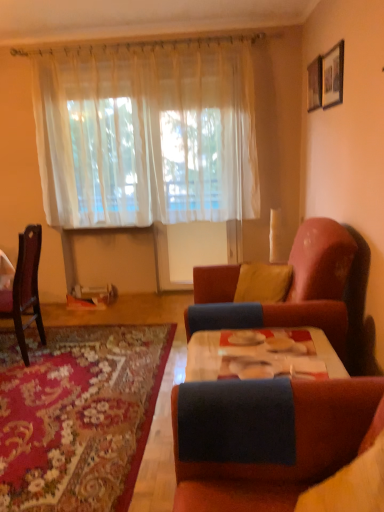
The width and height of the screenshot is (384, 512). Identify the location of translucent fabric curtain at center. (201, 140).

What do you see at coordinates (25, 288) in the screenshot?
I see `dark wood chair at left` at bounding box center [25, 288].

What do you see at coordinates (315, 84) in the screenshot? The height and width of the screenshot is (512, 384). I see `wooden picture frame at upper right, placed as the 1th picture frame when sorted from back to front` at bounding box center [315, 84].

This screenshot has height=512, width=384. Describe the element at coordinates (146, 134) in the screenshot. I see `sheer white curtain at upper center` at that location.

The height and width of the screenshot is (512, 384). What do you see at coordinates (333, 76) in the screenshot?
I see `wooden picture frame at upper right, acting as the 2th picture frame starting from the back` at bounding box center [333, 76].

I want to click on wooden picture frame at upper right, arranged as the first picture frame when viewed from the front, so click(333, 76).

Find the location of a particular element. This screenshot has width=384, height=512. carpeted rug at lower left is located at coordinates (78, 415).

Locate an element on the screen. This screenshot has width=384, height=512. yellow fabric pillow at center is located at coordinates (263, 282).

Is wooden picture frame at upper right, arranged as the first picture frame when viewed from the front, in contact with carpeted rug at lower left?

No, wooden picture frame at upper right, arranged as the first picture frame when viewed from the front, is not beside carpeted rug at lower left.

Locate an element on the screen. Image resolution: width=384 pixels, height=512 pixels. mat lying on the left of wooden picture frame at upper right, arranged as the first picture frame when viewed from the front is located at coordinates (78, 415).

From a real-world perspective, which is physically below, wooden picture frame at upper right, acting as the 2th picture frame starting from the back, or carpeted rug at lower left?

carpeted rug at lower left is physically lower.

Based on the photo, which is more distant, (332, 86) or (142, 337)?

Positioned behind is point (142, 337).

Is carpeted rug at lower left looking in the opposite direction of yellow fabric pillow at center?

No, yellow fabric pillow at center is not at the back of carpeted rug at lower left.

Are carpeted rug at lower left and yellow fabric pillow at center making contact?

There is a gap between carpeted rug at lower left and yellow fabric pillow at center.

From a real-world perspective, is carpeted rug at lower left under yellow fabric pillow at center?

Correct, in the physical world, carpeted rug at lower left is lower than yellow fabric pillow at center.

Is carpeted rug at lower left spatially inside yellow fabric pillow at center, or outside of it?

carpeted rug at lower left is not inside yellow fabric pillow at center, it's outside.

The height and width of the screenshot is (512, 384). I want to click on mat lying below the yellow fabric pillow at center (from the image's perspective), so click(x=78, y=415).

Based on the photo, considering their positions, is yellow fabric pillow at center located in front of or behind carpeted rug at lower left?

yellow fabric pillow at center is positioned farther from the viewer than carpeted rug at lower left.

Based on their positions, is yellow fabric pillow at center located to the left or right of carpeted rug at lower left?

Based on their positions, yellow fabric pillow at center is located to the right of carpeted rug at lower left.

From the image's perspective, which is above, dark wood chair at left or wooden picture frame at upper right, which appears as the second picture frame when viewed from the front?

wooden picture frame at upper right, which appears as the second picture frame when viewed from the front, is shown above in the image.

Which is behind, dark wood chair at left or wooden picture frame at upper right, which appears as the second picture frame when viewed from the front?

Positioned behind is wooden picture frame at upper right, which appears as the second picture frame when viewed from the front.

Is dark wood chair at left aimed at wooden picture frame at upper right, which appears as the second picture frame when viewed from the front?

No, dark wood chair at left is not oriented towards wooden picture frame at upper right, which appears as the second picture frame when viewed from the front.

Which is correct: carpeted rug at lower left is inside velvet pink couch at right, or outside of it?

carpeted rug at lower left is outside velvet pink couch at right.

How many degrees apart are the facing directions of carpeted rug at lower left and velvet pink couch at right?

The angle between the facing direction of carpeted rug at lower left and the facing direction of velvet pink couch at right is 88.8 degrees.

Is carpeted rug at lower left wider or thinner than velvet pink couch at right?

In the image, carpeted rug at lower left appears to be wider than velvet pink couch at right.

Is carpeted rug at lower left at the right side of velvet pink couch at right?

Incorrect, carpeted rug at lower left is not on the right side of velvet pink couch at right.

Consider the image. Is sheer white curtain at upper center behind wooden picture frame at upper right, acting as the 2th picture frame starting from the back?

Yes, sheer white curtain at upper center is behind wooden picture frame at upper right, acting as the 2th picture frame starting from the back.

Image resolution: width=384 pixels, height=512 pixels. I want to click on curtain that is below the wooden picture frame at upper right, acting as the 2th picture frame starting from the back (from the image's perspective), so click(146, 134).

Is sheer white curtain at upper center completely or partially outside of wooden picture frame at upper right, arranged as the first picture frame when viewed from the front?

Yes, sheer white curtain at upper center is outside of wooden picture frame at upper right, arranged as the first picture frame when viewed from the front.

Is sheer white curtain at upper center with wooden picture frame at upper right, arranged as the first picture frame when viewed from the front?

No, sheer white curtain at upper center is not in contact with wooden picture frame at upper right, arranged as the first picture frame when viewed from the front.

Could you tell me if translucent fabric curtain at center is turned towards velvet pink couch at right?

Yes.

Based on the photo, from a real-world perspective, is translucent fabric curtain at center physically located above or below velvet pink couch at right?

From a real-world perspective, translucent fabric curtain at center is physically above velvet pink couch at right.

Looking at this image, which of these two, translucent fabric curtain at center or velvet pink couch at right, stands taller?

translucent fabric curtain at center.

At what (x,y) coordinates should I click in order to perform the action: click on mat that appears below the wooden picture frame at upper right, acting as the 2th picture frame starting from the back (from the image's perspective). Please return your answer as a coordinate pair (x, y). Looking at the image, I should click on (78, 415).

Identify the location of pillow lying behind the carpeted rug at lower left. This screenshot has height=512, width=384. pos(263,282).

Consider the image. Based on their spatial positions, is sheer white curtain at upper center or yellow fabric pillow at center closer to wooden picture frame at upper right, arranged as the first picture frame when viewed from the front?

Based on the image, yellow fabric pillow at center appears to be nearer to wooden picture frame at upper right, arranged as the first picture frame when viewed from the front.

Based on the photo, estimate the real-world distances between objects in this image. Which object is further from carpeted rug at lower left, sheer white curtain at upper center or wooden picture frame at upper right, placed as the 1th picture frame when sorted from back to front?

wooden picture frame at upper right, placed as the 1th picture frame when sorted from back to front, is positioned further to the anchor carpeted rug at lower left.

Estimate the real-world distances between objects in this image. Which object is closer to dark wood chair at left, yellow fabric pillow at center or carpeted rug at lower left?

Among the two, carpeted rug at lower left is located nearer to dark wood chair at left.

Looking at the image, which one is located further to translucent fabric curtain at center, sheer white curtain at upper center or yellow fabric pillow at center?

Among the two, yellow fabric pillow at center is located further to translucent fabric curtain at center.

From the image, which object appears to be nearer to sheer white curtain at upper center, yellow fabric pillow at center or translucent fabric curtain at center?

translucent fabric curtain at center is closer to sheer white curtain at upper center.

Looking at the image, which one is located closer to yellow fabric pillow at center, sheer white curtain at upper center or dark wood chair at left?

sheer white curtain at upper center lies closer to yellow fabric pillow at center than the other object.

Based on their spatial positions, is wooden picture frame at upper right, acting as the 2th picture frame starting from the back, or translucent fabric curtain at center further from wooden picture frame at upper right, placed as the 1th picture frame when sorted from back to front?

translucent fabric curtain at center lies further to wooden picture frame at upper right, placed as the 1th picture frame when sorted from back to front, than the other object.

Looking at the image, which one is located further to wooden picture frame at upper right, placed as the 1th picture frame when sorted from back to front, yellow fabric pillow at center or carpeted rug at lower left?

The object further to wooden picture frame at upper right, placed as the 1th picture frame when sorted from back to front, is carpeted rug at lower left.

Locate an element on the screen. This screenshot has width=384, height=512. curtain between wooden picture frame at upper right, acting as the 2th picture frame starting from the back, and velvet pink couch at right, in the vertical direction is located at coordinates 146,134.

In order to click on studio couch between wooden picture frame at upper right, placed as the 1th picture frame when sorted from back to front, and carpeted rug at lower left, in the vertical direction in this screenshot , I will do `click(288, 290)`.

Locate an element on the screen. The image size is (384, 512). curtain between wooden picture frame at upper right, which appears as the second picture frame when viewed from the front, and velvet pink couch at right vertically is located at coordinates (146, 134).

Locate an element on the screen. The width and height of the screenshot is (384, 512). studio couch located between dark wood chair at left and yellow fabric pillow at center in the left-right direction is located at coordinates (288, 290).